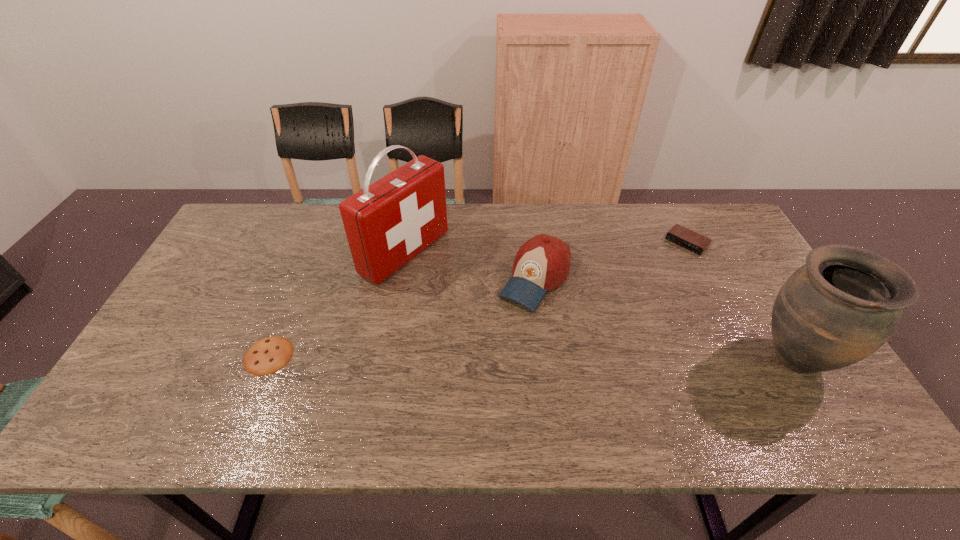
The height and width of the screenshot is (540, 960). Find the location of `vacant space that is in between the second object from left to right and the fourth shortest object`. vacant space that is in between the second object from left to right and the fourth shortest object is located at coordinates (599, 306).

Locate an element on the screen. The height and width of the screenshot is (540, 960). empty space that is in between the leftmost object and the urn is located at coordinates (531, 357).

The width and height of the screenshot is (960, 540). What are the coordinates of `vacant region between the baseball cap and the fourth tallest object` in the screenshot? It's located at (611, 261).

Where is `object that is the closest to the alarm clock`? This screenshot has height=540, width=960. object that is the closest to the alarm clock is located at coordinates tap(840, 307).

Choose which object is the second nearest neighbor to the tallest object. Please provide its 2D coordinates. Your answer should be formatted as a tuple, i.e. [(x, y)], where the tuple contains the x and y coordinates of a point satisfying the conditions above.

[(266, 356)]

Find the location of `vacant position in the image that satisfies the following two spatial constraints: 1. on the back side of the second shortest object; 2. on the right side of the third object from right to left`. vacant position in the image that satisfies the following two spatial constraints: 1. on the back side of the second shortest object; 2. on the right side of the third object from right to left is located at coordinates (531, 243).

Identify the location of vacant space that satisfies the following two spatial constraints: 1. on the back side of the cookie; 2. on the right side of the baseball cap. The width and height of the screenshot is (960, 540). 300,279.